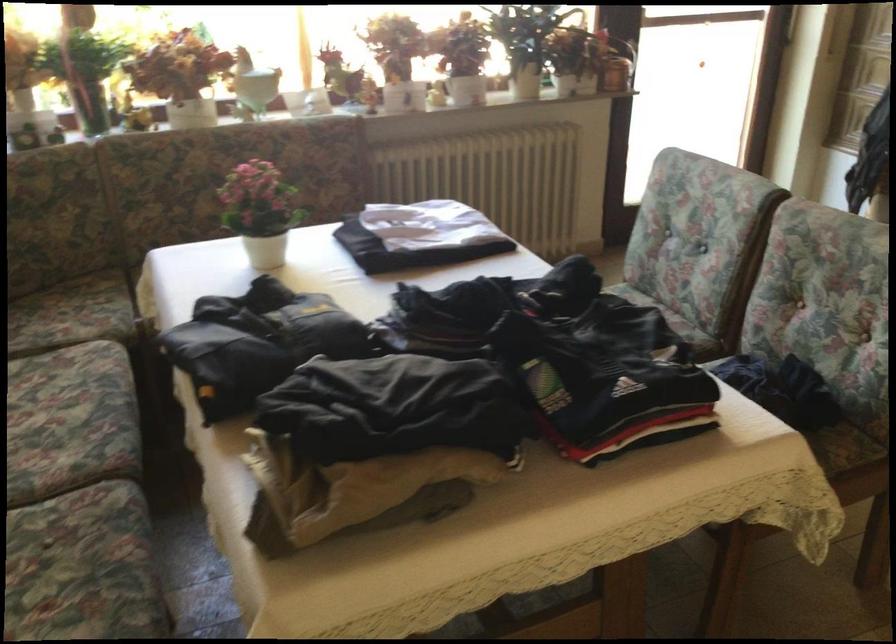
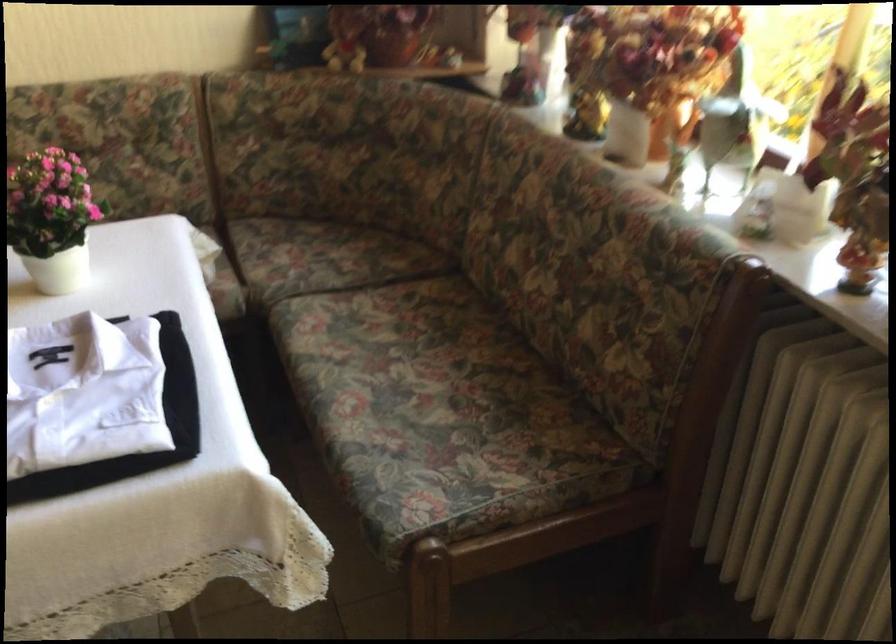
In the second image, find the point that corresponds to (289,198) in the first image.

(52, 218)